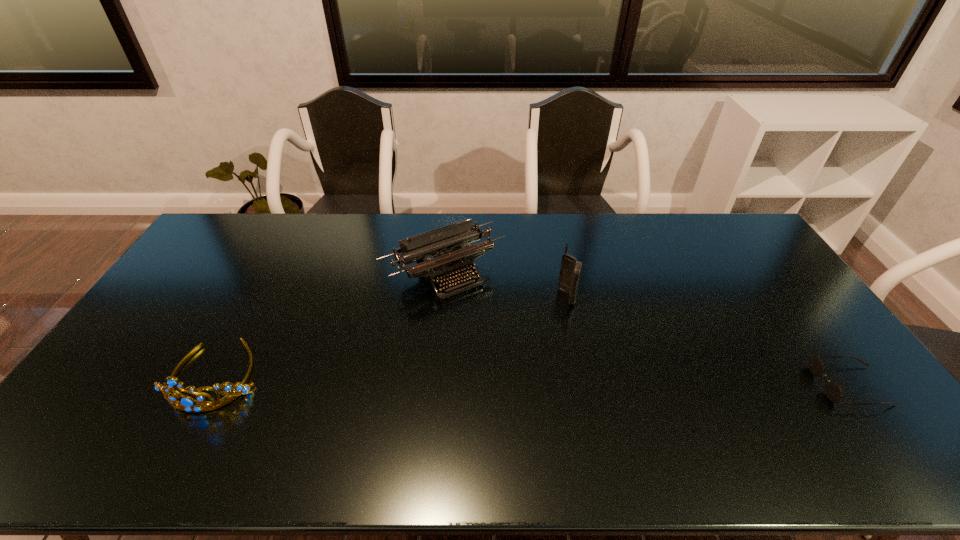
Find the location of a particular element. empty space between the second object from left to right and the tiara is located at coordinates (330, 323).

At what (x,y) coordinates should I click in order to perform the action: click on free space between the leftmost object and the typewriter. Please return your answer as a coordinate pair (x, y). Looking at the image, I should click on pyautogui.click(x=330, y=323).

Where is `free space that is in between the cellular telephone and the leftmost object`? Image resolution: width=960 pixels, height=540 pixels. free space that is in between the cellular telephone and the leftmost object is located at coordinates (392, 335).

The width and height of the screenshot is (960, 540). What are the coordinates of `free space between the shortest object and the typewriter` in the screenshot? It's located at (647, 328).

I want to click on empty space between the rightmost object and the cellular telephone, so click(708, 341).

Identify which object is the second nearest to the second object from right to left. Please provide its 2D coordinates. Your answer should be formatted as a tuple, i.e. [(x, y)], where the tuple contains the x and y coordinates of a point satisfying the conditions above.

[(834, 392)]

Find the location of a particular element. The image size is (960, 540). the closest object to the cellular telephone is located at coordinates click(x=453, y=255).

Image resolution: width=960 pixels, height=540 pixels. What are the coordinates of `free spot that satisfies the following two spatial constraints: 1. on the front side of the second object from left to right; 2. on the right side of the tallest object` in the screenshot? It's located at (443, 296).

Image resolution: width=960 pixels, height=540 pixels. I want to click on vacant space that satisfies the following two spatial constraints: 1. on the front side of the second object from left to right; 2. on the left side of the tallest object, so click(443, 296).

You are a GUI agent. You are given a task and a screenshot of the screen. Output one action in this format:
    pyautogui.click(x=<x>, y=<y>)
    Task: Click on the blank area in the image that satisfies the following two spatial constraints: 1. on the front side of the shortest object; 2. on the front-facing side of the tallest object
    Image resolution: width=960 pixels, height=540 pixels.
    Given the screenshot: What is the action you would take?
    pyautogui.click(x=587, y=385)